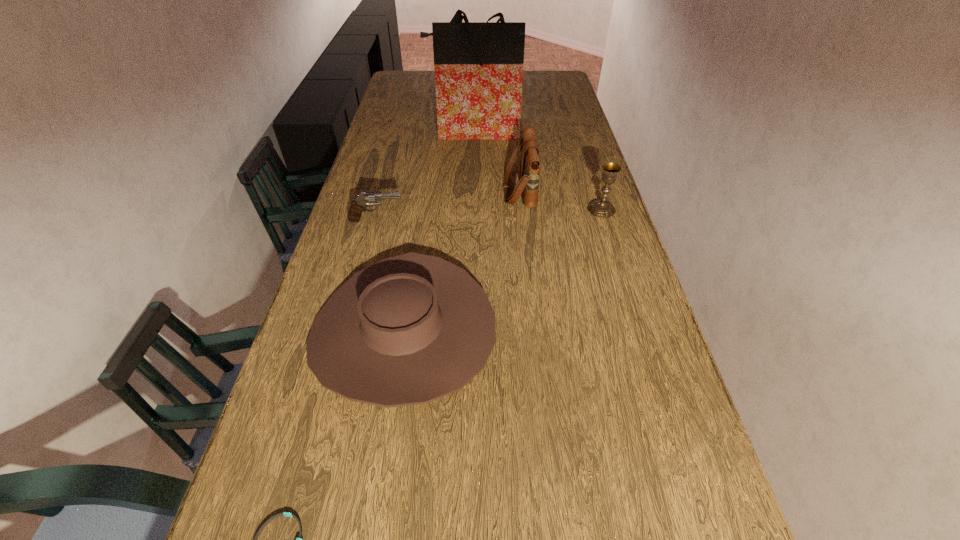
What are the coordinates of `free space between the pistol and the third tallest object` in the screenshot? It's located at (489, 215).

I want to click on vacant space that's between the pistol and the chalice, so click(x=489, y=215).

The height and width of the screenshot is (540, 960). Find the location of `vacant region between the rightmost object and the shoulder bag`. vacant region between the rightmost object and the shoulder bag is located at coordinates (561, 200).

Where is `free spot between the tallest object and the cowboy hat`? This screenshot has height=540, width=960. free spot between the tallest object and the cowboy hat is located at coordinates (x=439, y=232).

What are the coordinates of `vacant space that is in between the cowboy hat and the third tallest object` in the screenshot? It's located at (502, 271).

Point out which object is positioned as the nearest to the farthest object. Please provide its 2D coordinates. Your answer should be formatted as a tuple, i.e. [(x, y)], where the tuple contains the x and y coordinates of a point satisfying the conditions above.

[(528, 185)]

Find the location of `object that is the fifth nearest to the chalice`. object that is the fifth nearest to the chalice is located at coordinates (269, 520).

Find the location of `free space that satisfies the following two spatial constraints: 1. on the front side of the farthest object; 2. at the barrel of the pistol`. free space that satisfies the following two spatial constraints: 1. on the front side of the farthest object; 2. at the barrel of the pistol is located at coordinates (471, 220).

Locate an element on the screen. This screenshot has width=960, height=540. free space that satisfies the following two spatial constraints: 1. at the barrel of the cowboy hat; 2. on the right side of the pistol is located at coordinates (346, 332).

At what (x,y) coordinates should I click in order to perform the action: click on vacant area in the image that satisfies the following two spatial constraints: 1. on the front side of the shopping bag; 2. at the barrel of the pistol. Please return your answer as a coordinate pair (x, y). The height and width of the screenshot is (540, 960). Looking at the image, I should click on (471, 220).